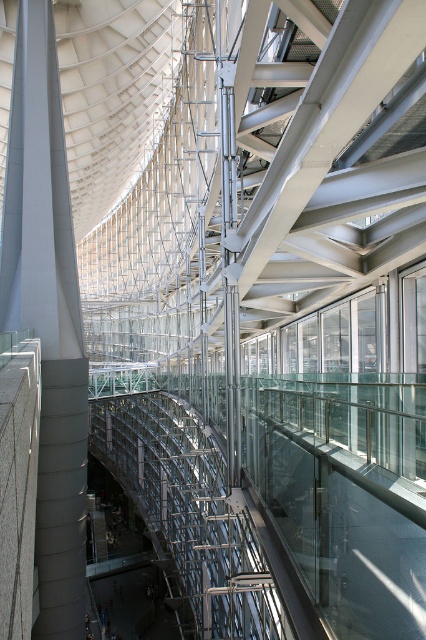
You are an architect examining the modern transportation hub. You need to determine the visibility of the transparent glass scaffolding at center from your current position near the smooth gray pillar at left. Can you see it clearly?

The transparent glass scaffolding at center is behind the smooth gray pillar at left, so it might be partially or fully obstructed from your current viewpoint near the smooth gray pillar at left.

You are an architect evaluating the structural integrity of the space. Considering the smooth gray pillar at left and the transparent glass scaffolding at center, which one is narrower in width?

The smooth gray pillar at left has a lesser width compared to the transparent glass scaffolding at center, so the smooth gray pillar at left is narrower in width.

You are standing in this modern transportation hub and need to walk from the entrance to the ticket counter located behind the transparent glass scaffolding at center. There is a smooth gray pillar at left blocking your path. Can you walk around it to reach the scaffolding?

Yes, you can walk around the smooth gray pillar at left to reach the transparent glass scaffolding at center since the pillar is positioned to the left of the scaffolding, allowing a clear path to the right side of the pillar.